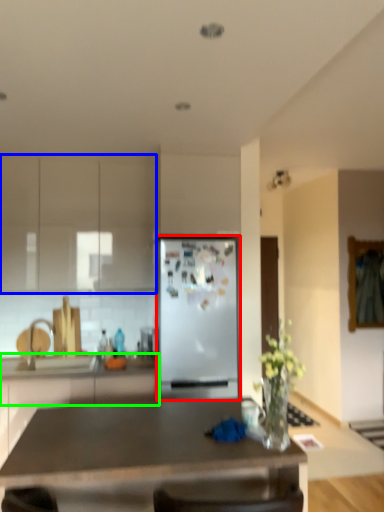
Question: Considering the real-world distances, which object is closest to refrigerator (highlighted by a red box)? cabinetry (highlighted by a blue box) or counter top (highlighted by a green box).

Choices:
 (A) cabinetry
 (B) counter top

Answer: (B)